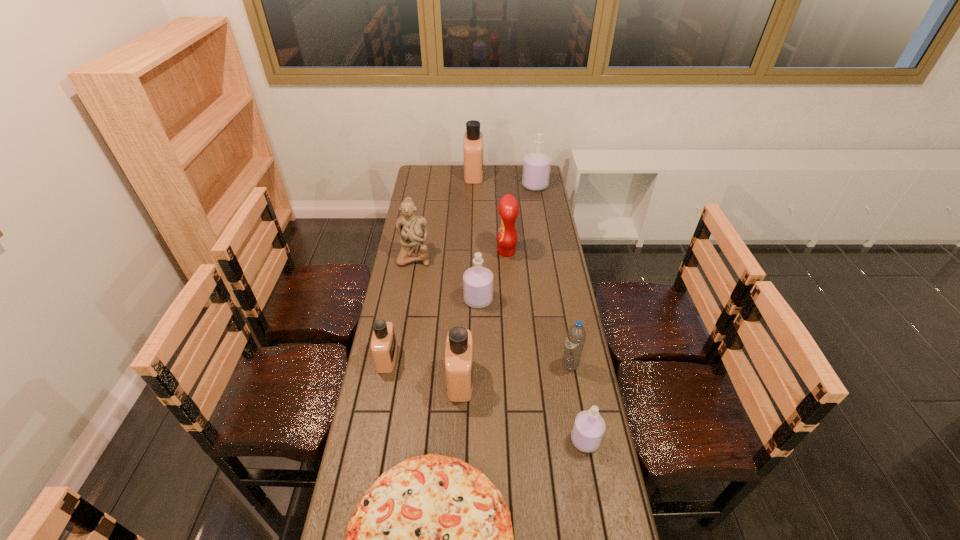
Locate an element on the screen. The height and width of the screenshot is (540, 960). the third closest perfume to the condiment is located at coordinates (473, 138).

Locate an element on the screen. perfume that is the fourth closest to the second smallest beige perfume is located at coordinates (536, 166).

Locate which beige perfume is the closest to the farthest beige perfume. Please provide its 2D coordinates. Your answer should be formatted as a tuple, i.e. [(x, y)], where the tuple contains the x and y coordinates of a point satisfying the conditions above.

[(383, 343)]

What are the coordinates of `beige perfume that is the nearest to the biggest beige perfume` in the screenshot? It's located at (383, 343).

Locate an element on the screen. The width and height of the screenshot is (960, 540). purple perfume identified as the third closest to the condiment is located at coordinates (589, 426).

Find the location of a particular element. Image resolution: width=960 pixels, height=540 pixels. the closest purple perfume to the nearest purple perfume is located at coordinates (477, 281).

Locate an element on the screen. free space that satisfies the following two spatial constraints: 1. on the front side of the water bottle; 2. on the left side of the smallest purple perfume is located at coordinates (584, 440).

This screenshot has height=540, width=960. What are the coordinates of `vacant space that satisfies the following two spatial constraints: 1. on the front label of the biggest beige perfume; 2. on the right side of the biggest purple perfume` in the screenshot? It's located at (473, 185).

This screenshot has width=960, height=540. I want to click on free region that satisfies the following two spatial constraints: 1. on the front label of the smallest beige perfume; 2. on the left side of the water bottle, so click(x=386, y=365).

Where is `blank space that satisfies the following two spatial constraints: 1. on the front label of the farthest beige perfume; 2. on the back side of the farthest purple perfume`? The width and height of the screenshot is (960, 540). blank space that satisfies the following two spatial constraints: 1. on the front label of the farthest beige perfume; 2. on the back side of the farthest purple perfume is located at coordinates (473, 185).